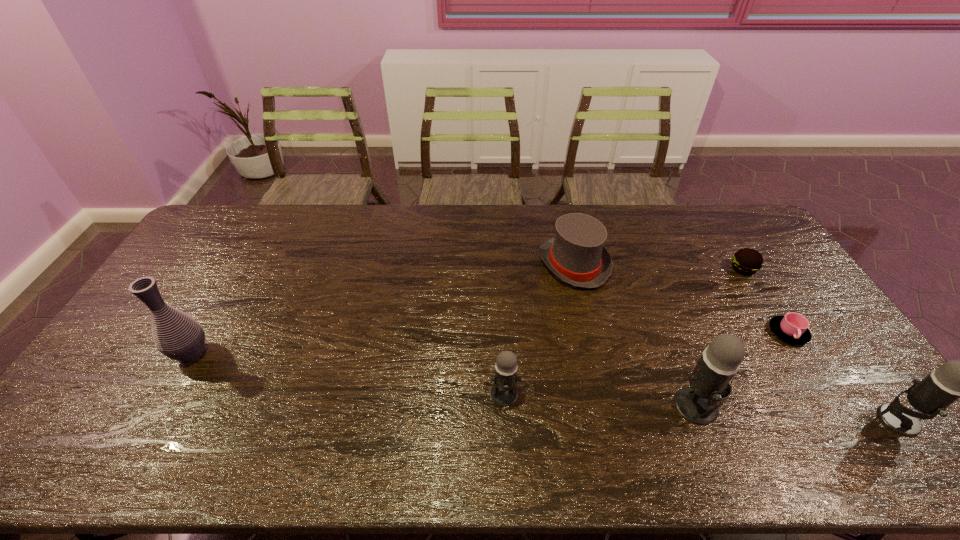
All microphones are currently evenly spaced. To continue this pattern, where would you add another microphone on the left? Please point out a vacant spot. Please provide its 2D coordinates. Your answer should be formatted as a tuple, i.e. [(x, y)], where the tuple contains the x and y coordinates of a point satisfying the conditions above.

[(321, 382)]